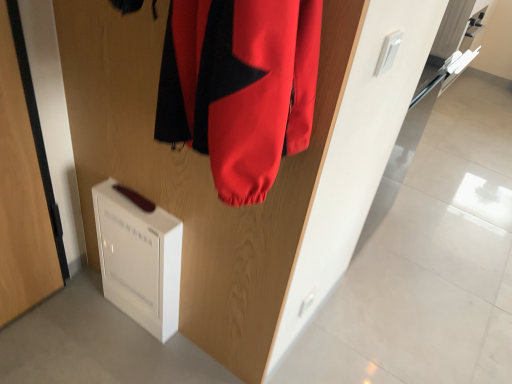
Identify the location of vacant area that is in front of white matte door at lower left, which is counted as the first door, starting from the left. The height and width of the screenshot is (384, 512). (31, 339).